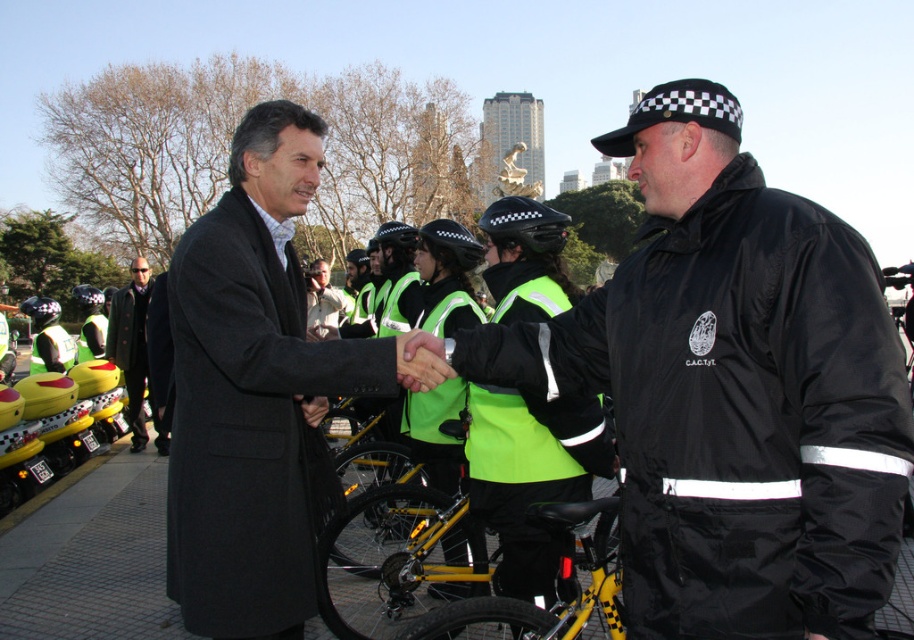
Question: Can you confirm if yellow metallic bicycle at center is thinner than green wool coat at center?

Choices:
 (A) no
 (B) yes

Answer: (A)

Question: Where is black glossy jacket at center located in relation to green wool coat at center in the image?

Choices:
 (A) below
 (B) above

Answer: (B)

Question: Which of the following is the closest to the observer?

Choices:
 (A) (745, 161)
 (B) (602, 605)
 (C) (119, 355)
 (D) (211, 442)

Answer: (B)

Question: Which of these objects is positioned closest to the green wool coat at center?

Choices:
 (A) yellow metallic bicycle at center
 (B) black glossy jacket at center
 (C) matte black coat at center

Answer: (C)

Question: From the image, what is the correct spatial relationship of yellow metallic bicycle at center in relation to green wool coat at center?

Choices:
 (A) right
 (B) left

Answer: (A)

Question: Which point is farther to the camera?

Choices:
 (A) green wool coat at center
 (B) yellow metallic bicycle at center
 (C) matte black coat at center
 (D) black glossy jacket at center

Answer: (A)